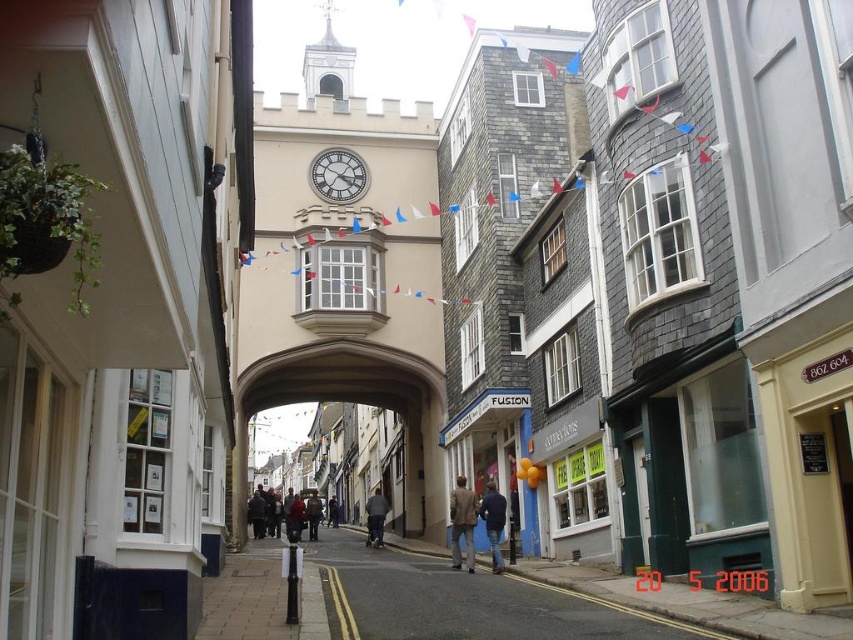
Does blue denim jacket at center have a smaller size compared to dark gray jacket at center?

Indeed, blue denim jacket at center has a smaller size compared to dark gray jacket at center.

Identify the location of blue denim jacket at center. This screenshot has height=640, width=853. (492, 522).

Locate an element on the screen. blue denim jacket at center is located at coordinates (492, 522).

Can you confirm if blue denim jacket at center is positioned to the left of dark brown leather jacket at center?

No, blue denim jacket at center is not to the left of dark brown leather jacket at center.

Measure the distance between point (480, 515) and camera.

The distance of point (480, 515) from camera is 79.89 meters.

Locate an element on the screen. The image size is (853, 640). blue denim jacket at center is located at coordinates (492, 522).

Between smooth asphalt road at center and light brown fabric coat at center, which one appears on the right side from the viewer's perspective?

From the viewer's perspective, light brown fabric coat at center appears more on the right side.

Is smooth asphalt road at center smaller than light brown fabric coat at center?

Actually, smooth asphalt road at center might be larger than light brown fabric coat at center.

Find the location of `smooth asphalt road at center`. smooth asphalt road at center is located at coordinates (463, 602).

Find the location of `smooth asphalt road at center`. smooth asphalt road at center is located at coordinates (463, 602).